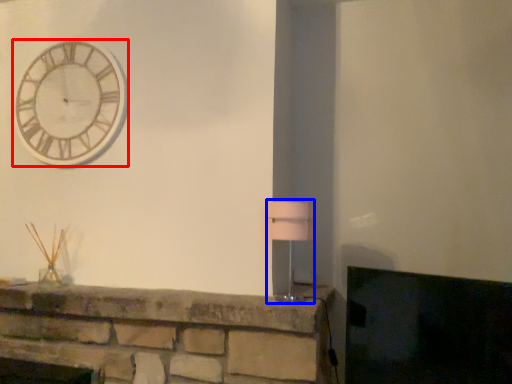
Question: Among these objects, which one is nearest to the camera, wall clock (highlighted by a red box) or table lamp (highlighted by a blue box)?

Choices:
 (A) wall clock
 (B) table lamp

Answer: (B)